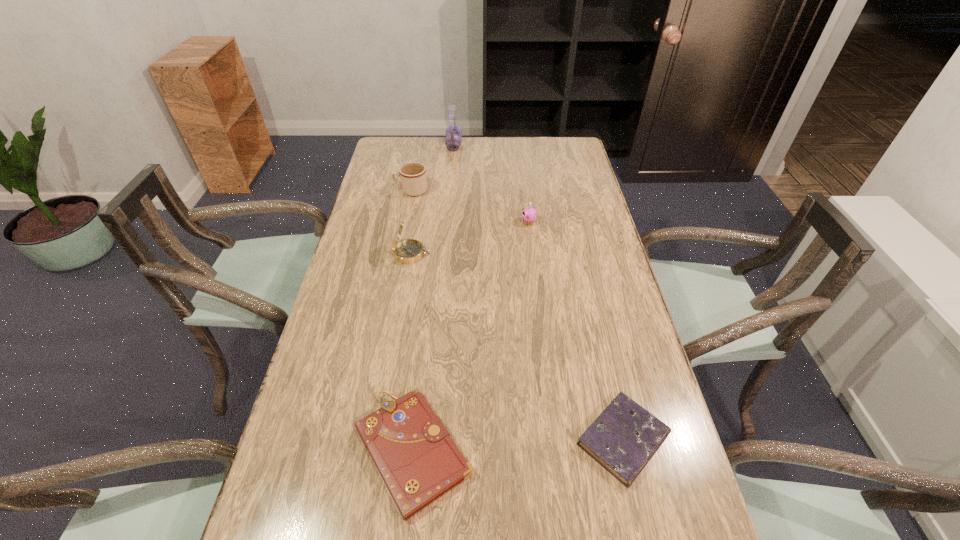
This screenshot has width=960, height=540. Identify the location of the farthest object. (453, 132).

Locate an element on the screen. The height and width of the screenshot is (540, 960). the tallest object is located at coordinates [453, 132].

Image resolution: width=960 pixels, height=540 pixels. In order to click on compass in this screenshot , I will do `click(408, 251)`.

Where is `the fourth farthest object`? The height and width of the screenshot is (540, 960). the fourth farthest object is located at coordinates (408, 251).

The width and height of the screenshot is (960, 540). I want to click on the fifth nearest object, so click(413, 178).

This screenshot has width=960, height=540. I want to click on the third farthest object, so click(529, 214).

Locate an element on the screen. This screenshot has height=540, width=960. the second object from right to left is located at coordinates (529, 214).

Identify the location of the second shortest object. (418, 461).

Locate an element on the screen. the shortest object is located at coordinates (623, 438).

At what (x,y) coordinates should I click in order to perform the action: click on diary. Please return your answer as a coordinate pair (x, y). Looking at the image, I should click on (623, 438).